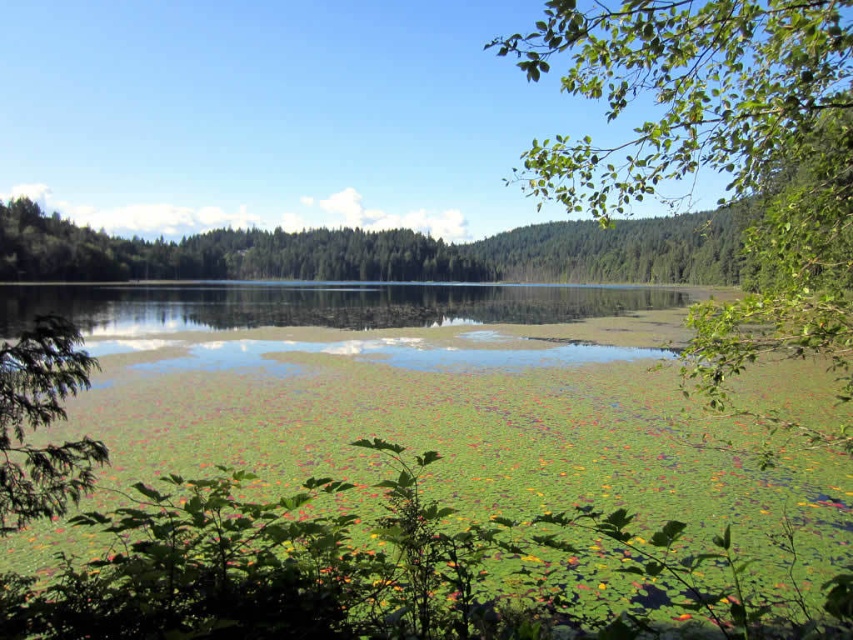
Question: Which point appears closest to the camera in this image?

Choices:
 (A) (612, 106)
 (B) (91, 481)

Answer: (A)

Question: Does green leafy branch at upper right lie in front of green leafy tree at left?

Choices:
 (A) yes
 (B) no

Answer: (A)

Question: Can you confirm if green leafy branch at upper right is positioned above green leafy tree at left?

Choices:
 (A) no
 (B) yes

Answer: (B)

Question: Which of the following is the closest to the observer?

Choices:
 (A) green leafy branch at upper right
 (B) green leafy tree at left

Answer: (A)

Question: Which object is closer to the camera taking this photo?

Choices:
 (A) green leafy branch at upper right
 (B) green leafy tree at left

Answer: (A)

Question: Does green leafy branch at upper right have a smaller size compared to green leafy tree at left?

Choices:
 (A) yes
 (B) no

Answer: (B)